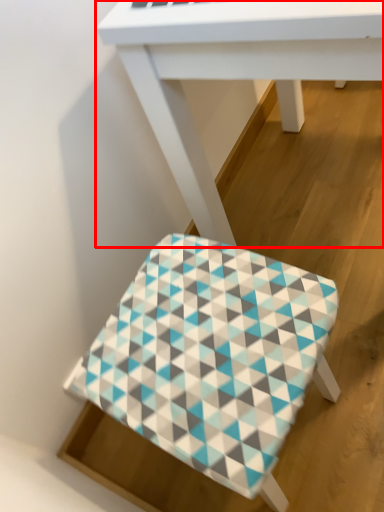
Question: Considering the relative positions of table (annotated by the red box) and stool in the image provided, where is table (annotated by the red box) located with respect to the staircase?

Choices:
 (A) right
 (B) left

Answer: (A)